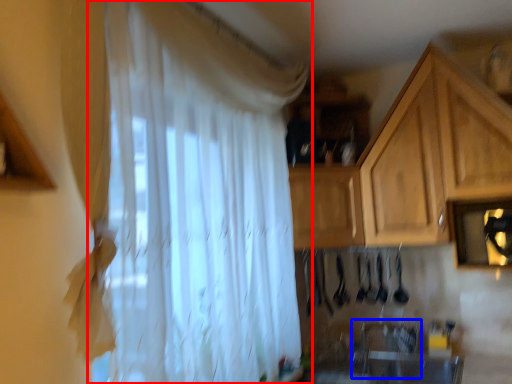
Question: Which object appears closest to the camera in this image, curtain (highlighted by a red box) or sink (highlighted by a blue box)?

Choices:
 (A) curtain
 (B) sink

Answer: (A)